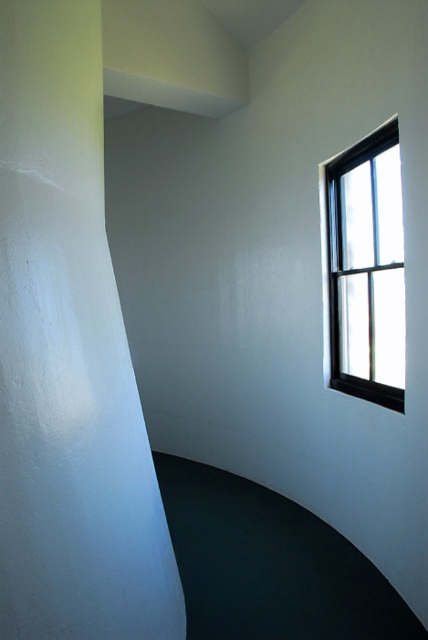
You are standing in the room and want to move from the white matte pillar at left to the black frame window at upper right. Which direction should you move to get closer to the window?

To move from the white matte pillar at left to the black frame window at upper right, you should move to the right since the pillar is to the left of the window.

You are a delivery robot with a width of 0.8 meters. You need to move from the white matte pillar at left to the black frame window at upper right. Is there enough space for you to navigate between them?

The distance between the white matte pillar at left and the black frame window at upper right is 1.16 meters. Since the robot is 0.8 meters wide, there is sufficient space for it to navigate between them as the distance is greater than the robot width.